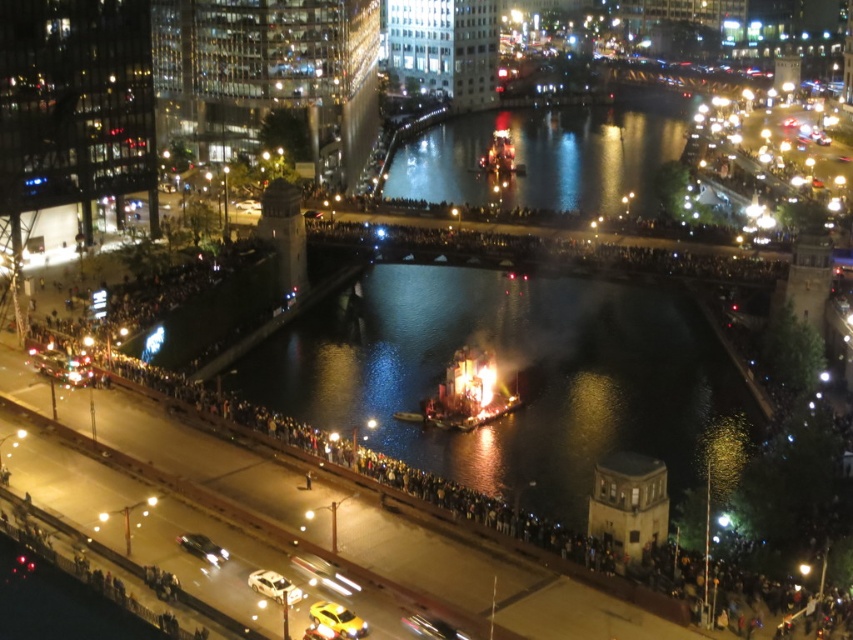
Does dark reflective water at center appear over reflective glass water at center?

No.

Which is behind, point (523, 435) or point (437, 125)?

Positioned behind is point (437, 125).

Locate an element on the screen. dark reflective water at center is located at coordinates (508, 376).

Which of these two, reflective glass water at center or shiny metallic structure at center, stands shorter?

shiny metallic structure at center

Does reflective glass water at center have a lesser height compared to shiny metallic structure at center?

In fact, reflective glass water at center may be taller than shiny metallic structure at center.

Find the location of a particular element. Image resolution: width=853 pixels, height=640 pixels. reflective glass water at center is located at coordinates (547, 157).

Does dark reflective water at center have a greater width compared to shiny metallic structure at center?

Yes.

How distant is dark reflective water at center from shiny metallic structure at center?

A distance of 31.57 feet exists between dark reflective water at center and shiny metallic structure at center.

Does point (619, 301) come closer to viewer compared to point (463, 368)?

No, (619, 301) is behind (463, 368).

The width and height of the screenshot is (853, 640). Find the location of `dark reflective water at center`. dark reflective water at center is located at coordinates (508, 376).